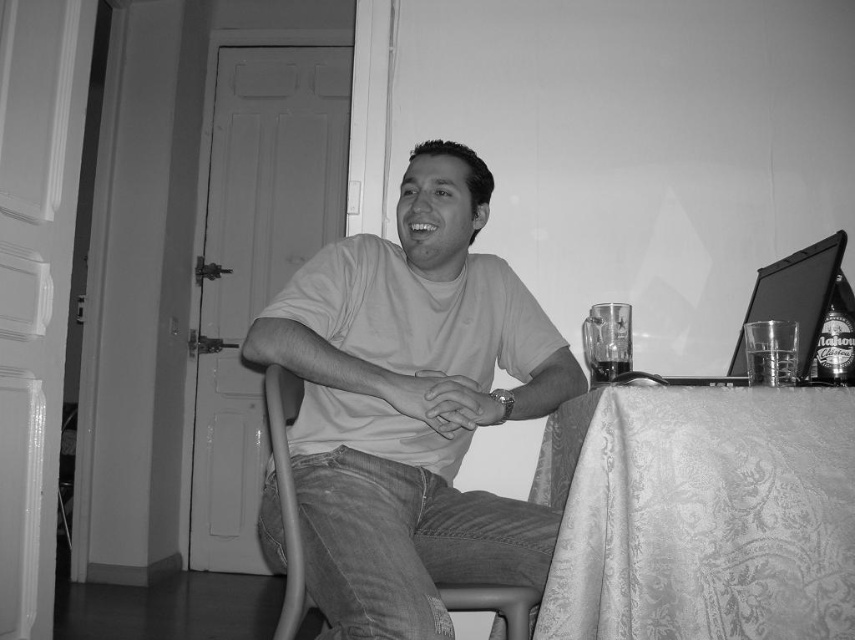
Question: Considering the real-world distances, which object is closest to the translucent glass at table right?

Choices:
 (A) silky white tablecloth at lower right
 (B) clear glass mug at table right
 (C) metallic gray chair at center
 (D) matte black laptop at right

Answer: (B)

Question: Is silky white tablecloth at lower right above translucent glass at table right?

Choices:
 (A) yes
 (B) no

Answer: (B)

Question: In this image, where is matte black laptop at right located relative to translucent glass bottle at right?

Choices:
 (A) above
 (B) below

Answer: (B)

Question: Does matte black laptop at right come in front of translucent glass bottle at right?

Choices:
 (A) no
 (B) yes

Answer: (B)

Question: Which point is closer to the camera?

Choices:
 (A) translucent glass bottle at right
 (B) smooth cotton t-shirt at center
 (C) translucent glass at table right
 (D) matte black laptop at right

Answer: (B)

Question: Which point appears closest to the camera in this image?

Choices:
 (A) (788, 358)
 (B) (505, 406)
 (C) (832, 307)
 (D) (823, 320)

Answer: (A)